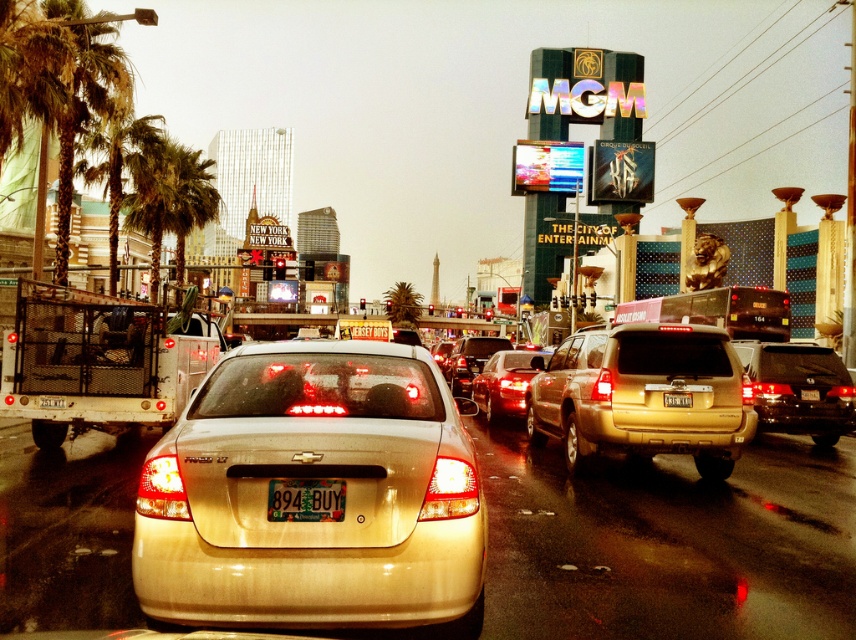
Does green leafy palm tree at left have a greater height compared to green plastic license plate at center?

Yes, green leafy palm tree at left is taller than green plastic license plate at center.

Can you confirm if green leafy palm tree at left is thinner than green plastic license plate at center?

No.

Identify the location of green leafy palm tree at left. (116, 163).

Can you confirm if metallic gold license plate at center is taller than white plastic license plate at center?

No.

At what (x,y) coordinates should I click in order to perform the action: click on metallic gold license plate at center. Please return your answer as a coordinate pair (x, y). Looking at the image, I should click on (676, 400).

Between point (685, 392) and point (815, 397), which one is positioned behind?

The point (815, 397) is behind.

Locate an element on the screen. The width and height of the screenshot is (856, 640). metallic gold license plate at center is located at coordinates (676, 400).

Can you confirm if shiny gold suv at center is wider than gold metallic sedan at center?

Correct, the width of shiny gold suv at center exceeds that of gold metallic sedan at center.

Which is behind, point (490, 422) or point (502, 344)?

Point (502, 344)

Image resolution: width=856 pixels, height=640 pixels. What are the coordinates of `shiny gold suv at center` in the screenshot? It's located at (504, 381).